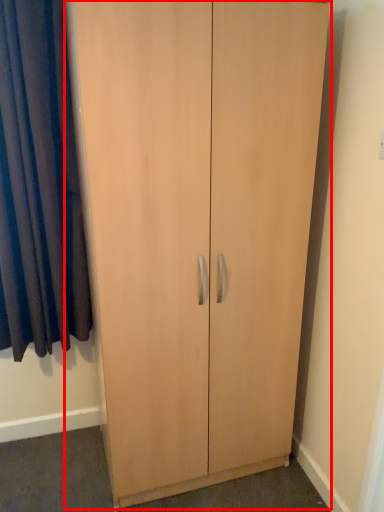
Question: From the image's perspective, what is the correct spatial relationship of cupboard (annotated by the red box) in relation to curtain?

Choices:
 (A) above
 (B) below

Answer: (B)